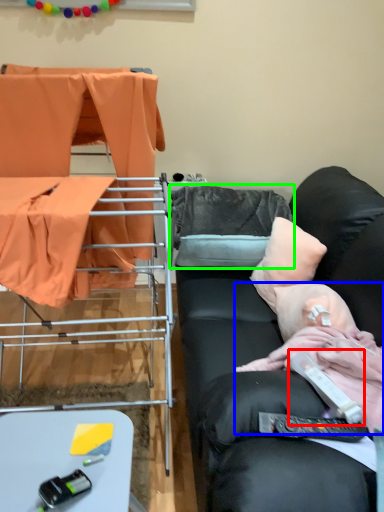
Question: Which is nearer to the equipment (highlighted by a red box)? person (highlighted by a blue box) or pillow (highlighted by a green box).

Choices:
 (A) person
 (B) pillow

Answer: (A)